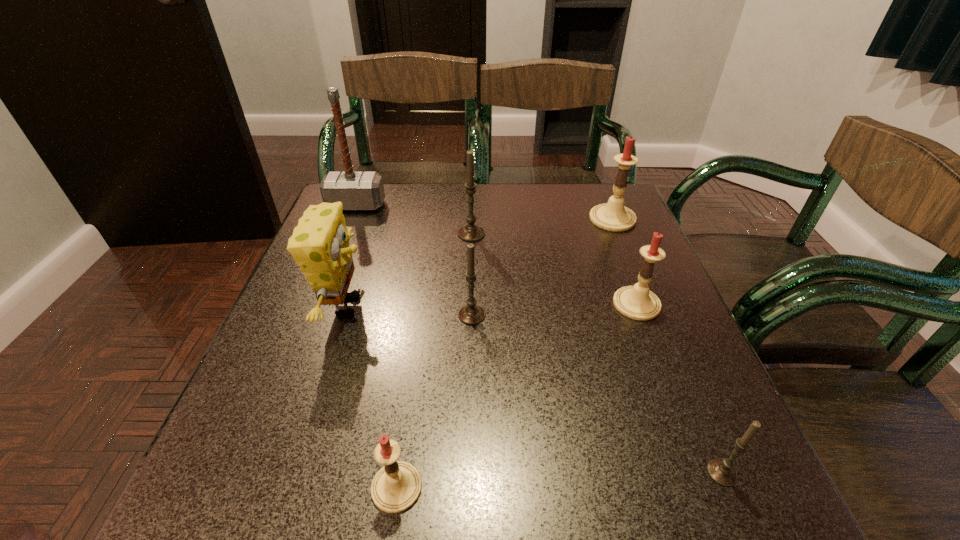
Find the location of a particular element. The image size is (960, 540). brown hammer is located at coordinates (355, 190).

Locate an element on the screen. hammer is located at coordinates (355, 190).

Identify the location of the biggest gray candle. coord(470,232).

At what (x,y) coordinates should I click in order to perform the action: click on the farthest red candle. Please return your answer as a coordinate pair (x, y). The width and height of the screenshot is (960, 540). Looking at the image, I should click on (613, 216).

At what (x,y) coordinates should I click in order to perform the action: click on sponge. Please return your answer as a coordinate pair (x, y). The height and width of the screenshot is (540, 960). Looking at the image, I should click on (320, 244).

Image resolution: width=960 pixels, height=540 pixels. Identify the location of the second biggest gray candle. (471, 314).

The image size is (960, 540). Find the location of `the second farthest red candle`. the second farthest red candle is located at coordinates (637, 302).

Identify the location of the rightmost gray candle. (721, 471).

Where is `the nearest gray candle`? Image resolution: width=960 pixels, height=540 pixels. the nearest gray candle is located at coordinates (721, 471).

The height and width of the screenshot is (540, 960). I want to click on the nearest red candle, so click(x=396, y=487).